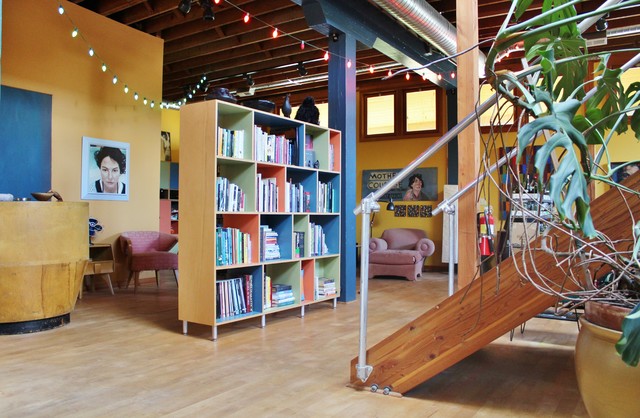
Where is `wood floor`? The height and width of the screenshot is (418, 640). wood floor is located at coordinates (253, 382).